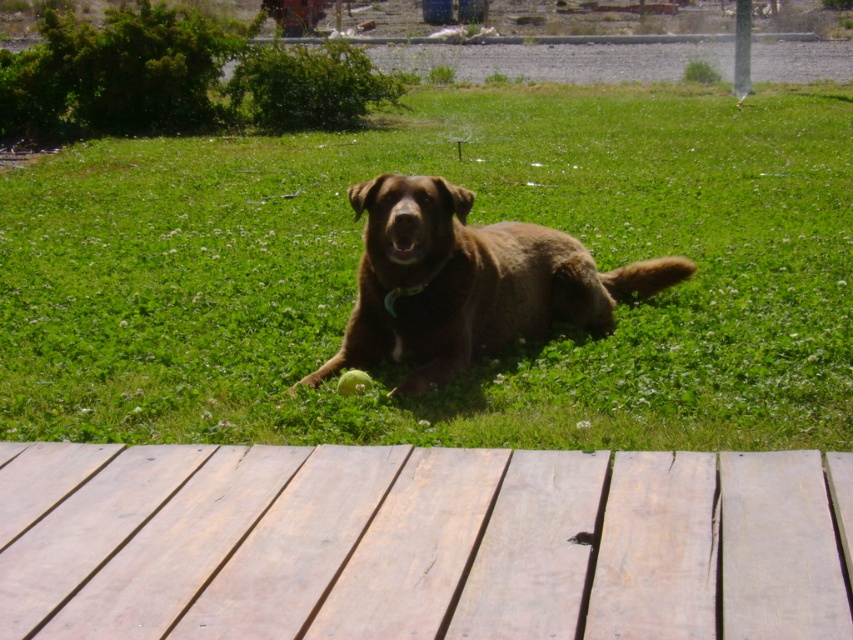
Who is taller, green grass at center or brown furry dog at center?

green grass at center is taller.

Where is `green grass at center`? Image resolution: width=853 pixels, height=640 pixels. green grass at center is located at coordinates (471, 221).

Is green grass at center wider than light brown wooden deck at lower center?

Yes.

Does green grass at center appear under light brown wooden deck at lower center?

Incorrect, green grass at center is not positioned below light brown wooden deck at lower center.

Is point (743, 221) farther from viewer compared to point (241, 636)?

Yes.

The width and height of the screenshot is (853, 640). What are the coordinates of `green grass at center` in the screenshot? It's located at (471, 221).

Between brown furry dog at center and green fabric neckband at center, which one appears on the left side from the viewer's perspective?

green fabric neckband at center

The width and height of the screenshot is (853, 640). Describe the element at coordinates (468, 282) in the screenshot. I see `brown furry dog at center` at that location.

Measure the distance between point (387, 291) and camera.

They are 13.57 feet apart.

You are a GUI agent. You are given a task and a screenshot of the screen. Output one action in this format:
    pyautogui.click(x=<x>, y=<y>)
    Task: Click on the brown furry dog at center
    The width and height of the screenshot is (853, 640).
    Given the screenshot: What is the action you would take?
    pyautogui.click(x=468, y=282)